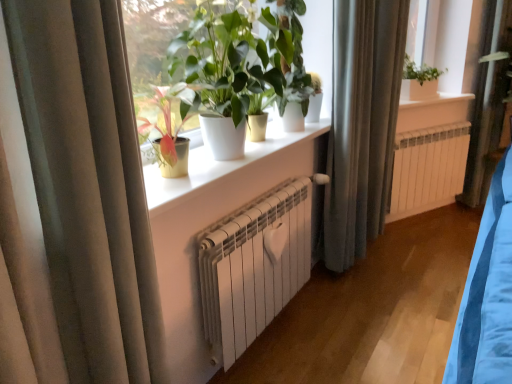
Find the location of a particular element. The width and height of the screenshot is (512, 384). vacant region below white matte radiator at center (from a real-world perspective) is located at coordinates (274, 339).